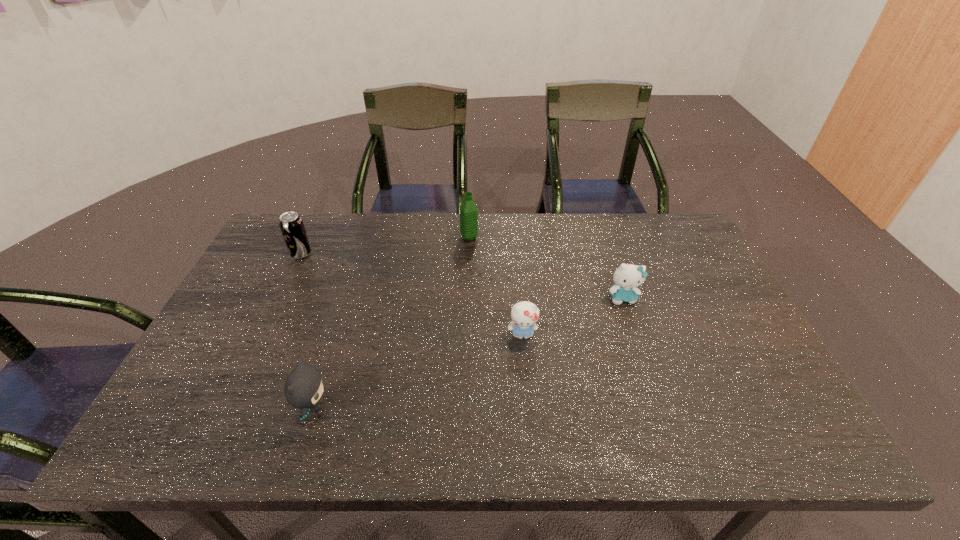
Identify the location of the farthest object. Image resolution: width=960 pixels, height=540 pixels. (468, 210).

Identify the location of water bottle. The height and width of the screenshot is (540, 960). (468, 210).

Image resolution: width=960 pixels, height=540 pixels. In order to click on the fourth nearest object in this screenshot , I will do pos(291,225).

Locate an element on the screen. The width and height of the screenshot is (960, 540). soda can is located at coordinates (291, 225).

You are a GUI agent. You are given a task and a screenshot of the screen. Output one action in this format:
    pyautogui.click(x=<x>, y=<y>)
    Task: Click on the fourth object from right to left
    The width and height of the screenshot is (960, 540).
    Given the screenshot: What is the action you would take?
    pyautogui.click(x=303, y=388)

I want to click on the nearest kitten, so click(x=303, y=388).

In order to click on the rightmost kitten in this screenshot , I will do `click(627, 277)`.

Where is `the farthest kitten`? This screenshot has width=960, height=540. the farthest kitten is located at coordinates click(x=627, y=277).

Find the location of a particular element. This screenshot has height=540, width=960. the fourth farthest object is located at coordinates (524, 314).

I want to click on the second kitten from left to right, so click(524, 314).